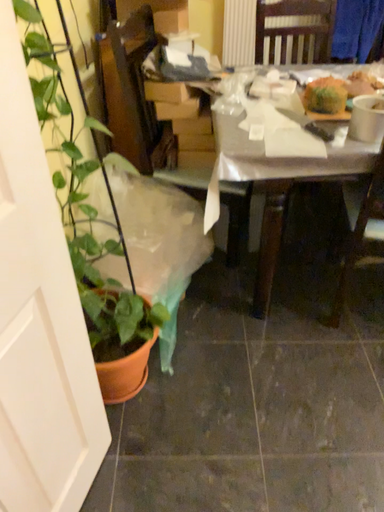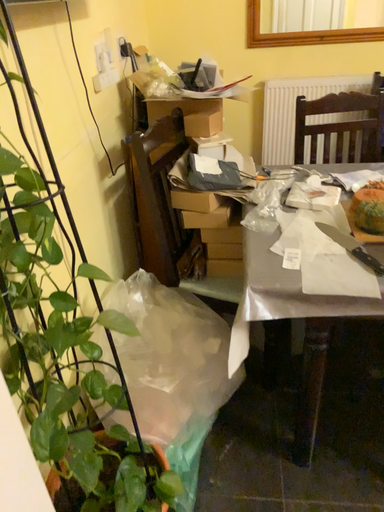
Question: How did the camera likely rotate when shooting the video?

Choices:
 (A) rotated right
 (B) rotated left

Answer: (B)